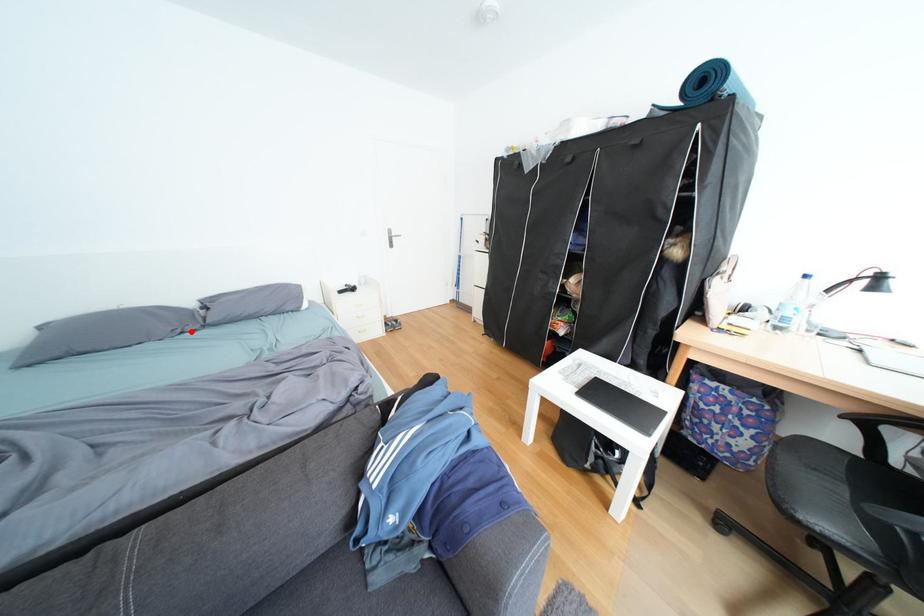
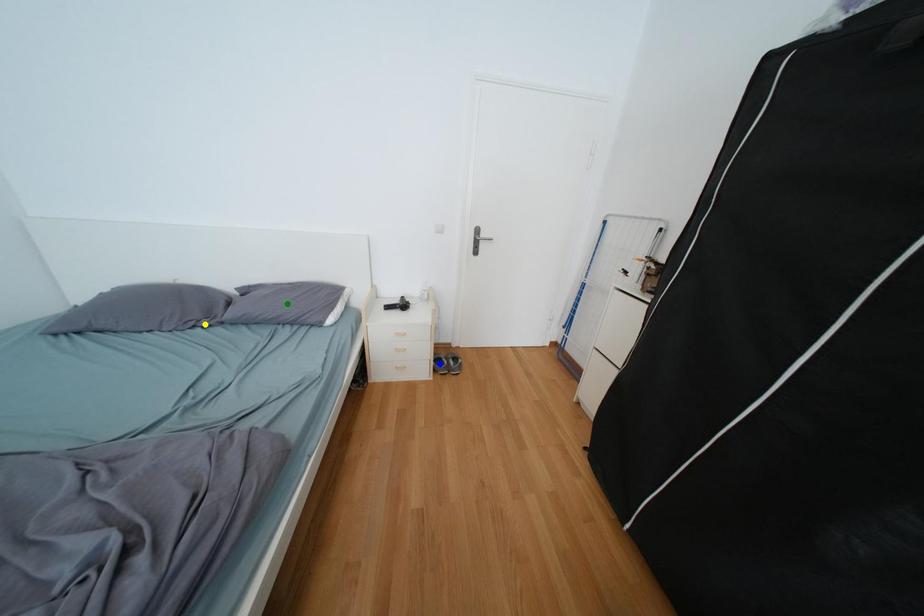
Question: I am providing you with two images of the same scene from different viewpoints. A red point is marked on the first image. You are given multiple points on the second image. Which spot in image 2 lines up with the point in image 1?

Choices:
 (A) blue point
 (B) yellow point
 (C) green point

Answer: (B)